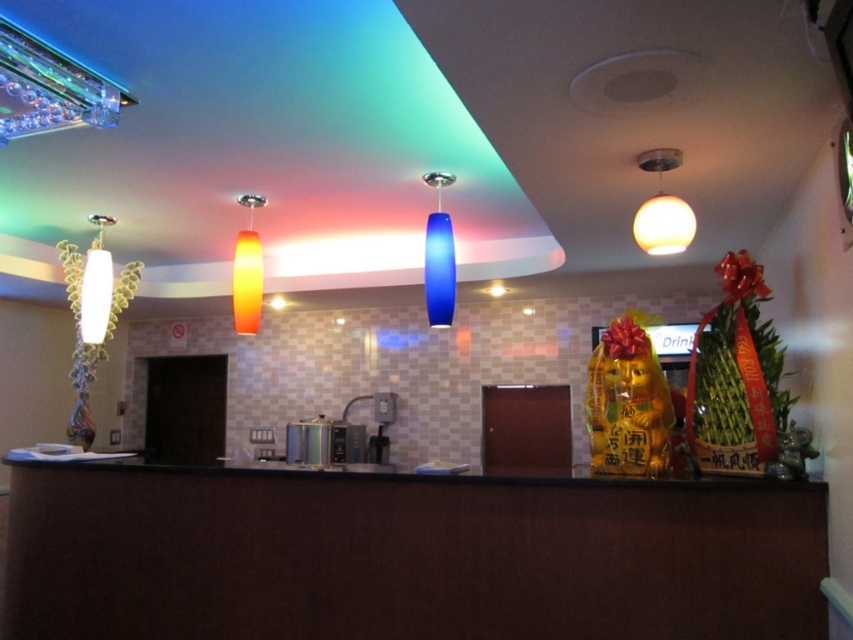
You are a maintenance worker needing to replace a light bulb. You see the blue glass pendant at center and the white glossy lamp at left. Which one is closer to you?

The blue glass pendant at center is 5.82 feet away from the white glossy lamp at left, so the distance between them is 5.82 feet. However, without knowing your exact position, it is impossible to determine which one is closer to you.

You are an interior designer planning to install a new light fixture in the reception area. You have two options available for installation space constraints. The first option requires a fixture that is wider than the blue glass pendant at center, and the second requires a fixture that is narrower than the white glossy lamp at left. Which option can you choose based on the existing fixtures?

The blue glass pendant at center is thinner than the white glossy lamp at left. Therefore, the second option requiring a fixture narrower than the white glossy lamp at left is possible since the blue glass pendant at center meets that criterion. The first option cannot be fulfilled because there is no fixture wider than the blue glass pendant mentioned here.

You are standing in the reception area and want to take a photo of the blue glass pendant at center without the white glossy lamp at left appearing in the background. Is this possible given their positions?

The blue glass pendant at center is in front of the white glossy lamp at left, so taking a photo focused on the blue glass pendant at center would naturally block the white glossy lamp at left from the background view.